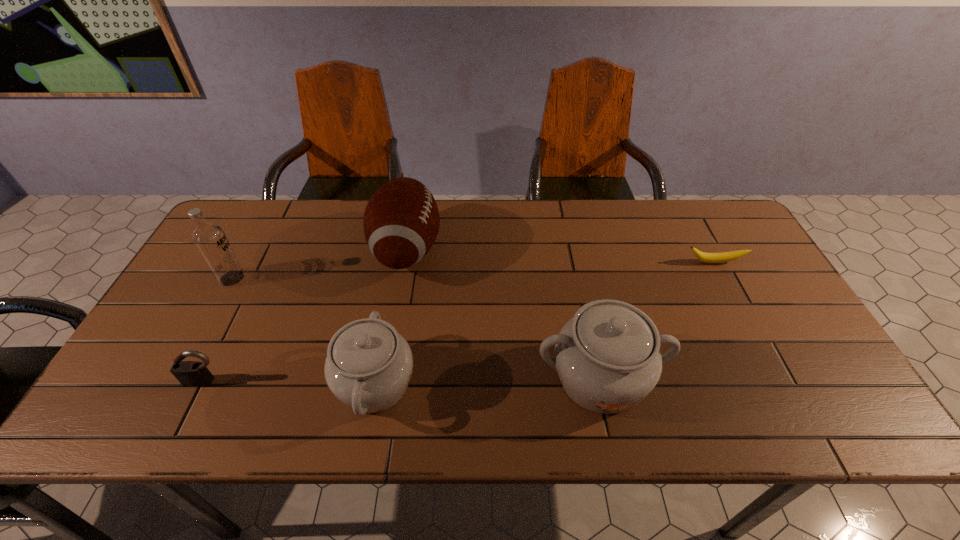
Find the location of a particular element. The width and height of the screenshot is (960, 540). free spot that satisfies the following two spatial constraints: 1. on the laces of the right chinaware; 2. on the right side of the football is located at coordinates (384, 379).

Where is `vacant space that satisfies the following two spatial constraints: 1. with the keyhole on the front of the padlock; 2. on the right side of the shorter chinaware`? vacant space that satisfies the following two spatial constraints: 1. with the keyhole on the front of the padlock; 2. on the right side of the shorter chinaware is located at coordinates (204, 384).

Where is `blank space that satisfies the following two spatial constraints: 1. on the laces of the football; 2. with the keyhole on the front of the padlock`? The width and height of the screenshot is (960, 540). blank space that satisfies the following two spatial constraints: 1. on the laces of the football; 2. with the keyhole on the front of the padlock is located at coordinates (384, 381).

This screenshot has height=540, width=960. In order to click on blank area in the image that satisfies the following two spatial constraints: 1. on the laces of the football; 2. with the keyhole on the front of the padlock in this screenshot , I will do (x=384, y=381).

This screenshot has height=540, width=960. Identify the location of vacant area in the image that satisfies the following two spatial constraints: 1. on the front label of the fourth tallest object; 2. on the left side of the vodka. (175, 384).